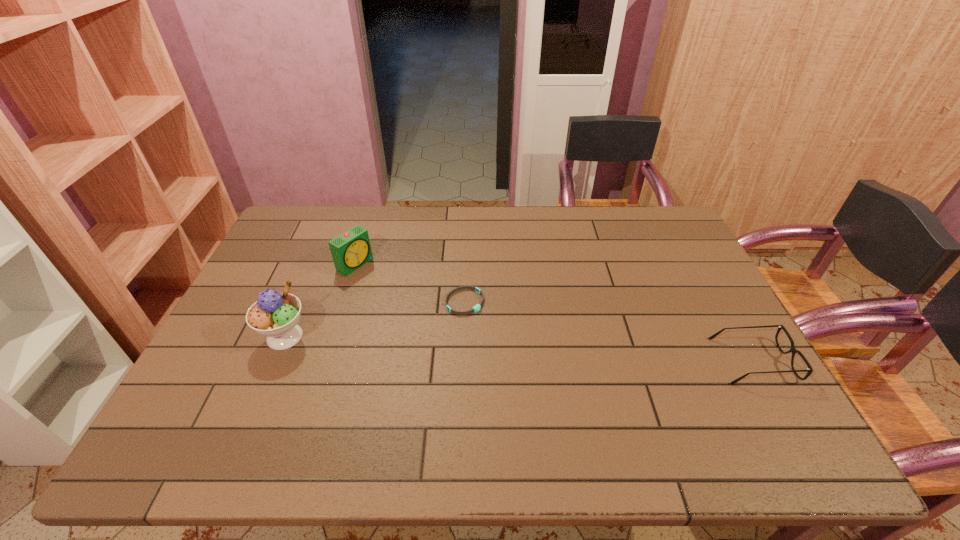
I want to click on vacant space situated with the lenses facing outward on the third tallest object, so (679, 361).

Locate an element on the screen. The image size is (960, 540). vacant area situated with the lenses facing outward on the third tallest object is located at coordinates (624, 361).

Find the location of a particular element. Image resolution: width=960 pixels, height=540 pixels. vacant space located on the front-facing side of the alarm clock is located at coordinates (430, 310).

Where is `vacant space located on the front-facing side of the alarm clock`? The height and width of the screenshot is (540, 960). vacant space located on the front-facing side of the alarm clock is located at coordinates (427, 308).

Find the location of a particular element. This screenshot has height=540, width=960. vacant point located on the front-facing side of the alarm clock is located at coordinates (381, 281).

Locate an element on the screen. vacant space located 0.210m on the buckle of the shortest object is located at coordinates (543, 344).

Where is `vacant space situated on the buckle of the shortest object`? vacant space situated on the buckle of the shortest object is located at coordinates (540, 342).

Image resolution: width=960 pixels, height=540 pixels. Identify the location of vacant region located on the buckle of the shortest object. (506, 323).

Locate an element on the screen. object at the near edge is located at coordinates (793, 350).

The width and height of the screenshot is (960, 540). I want to click on object at the left edge, so click(275, 315).